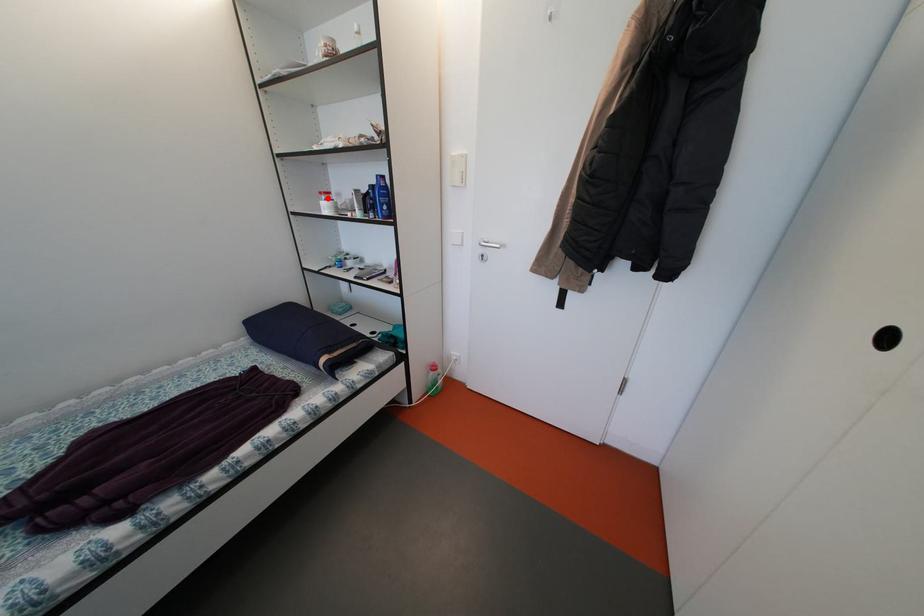
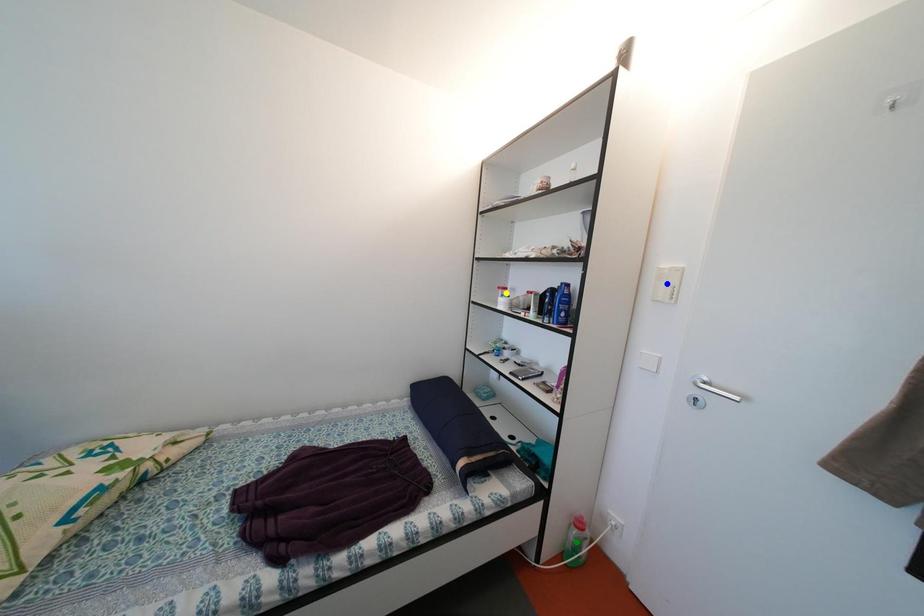
Question: I am providing you with two images of the same scene from different viewpoints. A red point is marked on the first image. You are given multiple points on the second image. Can you choose the point in image 2 that corresponds to the point in image 1?

Choices:
 (A) yellow point
 (B) blue point
 (C) green point

Answer: (A)